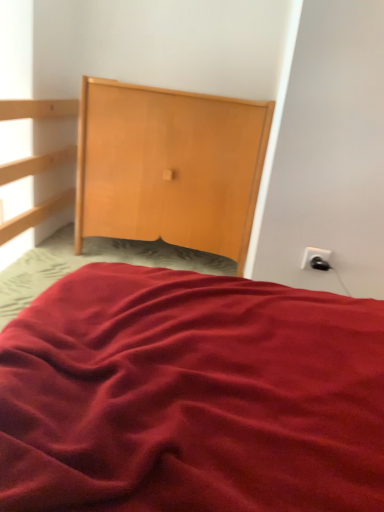
Question: Can you confirm if wooden dresser at upper center is positioned to the right of white plastic socket at upper right?

Choices:
 (A) yes
 (B) no

Answer: (B)

Question: Is wooden dresser at upper center taller than white plastic socket at upper right?

Choices:
 (A) no
 (B) yes

Answer: (B)

Question: Does wooden dresser at upper center have a lesser width compared to white plastic socket at upper right?

Choices:
 (A) yes
 (B) no

Answer: (B)

Question: Can you confirm if wooden dresser at upper center is smaller than white plastic socket at upper right?

Choices:
 (A) yes
 (B) no

Answer: (B)

Question: Does wooden dresser at upper center lie behind white plastic socket at upper right?

Choices:
 (A) no
 (B) yes

Answer: (B)

Question: Is wooden dresser at upper center turned away from white plastic socket at upper right?

Choices:
 (A) no
 (B) yes

Answer: (A)

Question: Is wooden dresser at upper center inside white plastic socket at upper right?

Choices:
 (A) yes
 (B) no

Answer: (B)

Question: Is white plastic socket at upper right to the left of wooden dresser at upper center from the viewer's perspective?

Choices:
 (A) yes
 (B) no

Answer: (B)

Question: Considering the relative sizes of white plastic socket at upper right and wooden dresser at upper center in the image provided, is white plastic socket at upper right shorter than wooden dresser at upper center?

Choices:
 (A) yes
 (B) no

Answer: (A)

Question: Considering the relative positions of white plastic socket at upper right and wooden dresser at upper center in the image provided, is white plastic socket at upper right in front of wooden dresser at upper center?

Choices:
 (A) no
 (B) yes

Answer: (B)

Question: From a real-world perspective, is white plastic socket at upper right located beneath wooden dresser at upper center?

Choices:
 (A) no
 (B) yes

Answer: (B)

Question: Is white plastic socket at upper right to the right of wooden dresser at upper center from the viewer's perspective?

Choices:
 (A) yes
 (B) no

Answer: (A)

Question: Which is correct: white plastic socket at upper right is inside wooden dresser at upper center, or outside of it?

Choices:
 (A) inside
 (B) outside

Answer: (B)